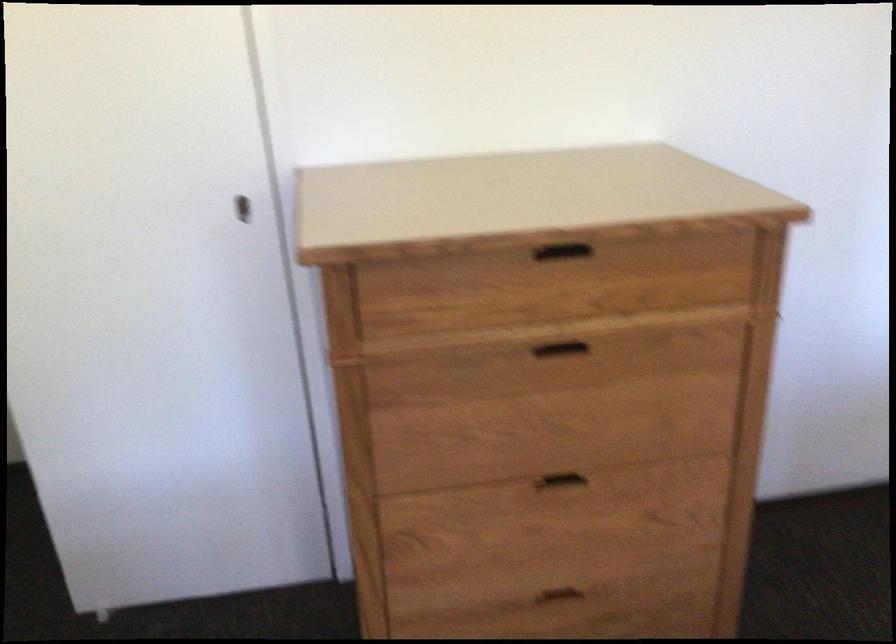
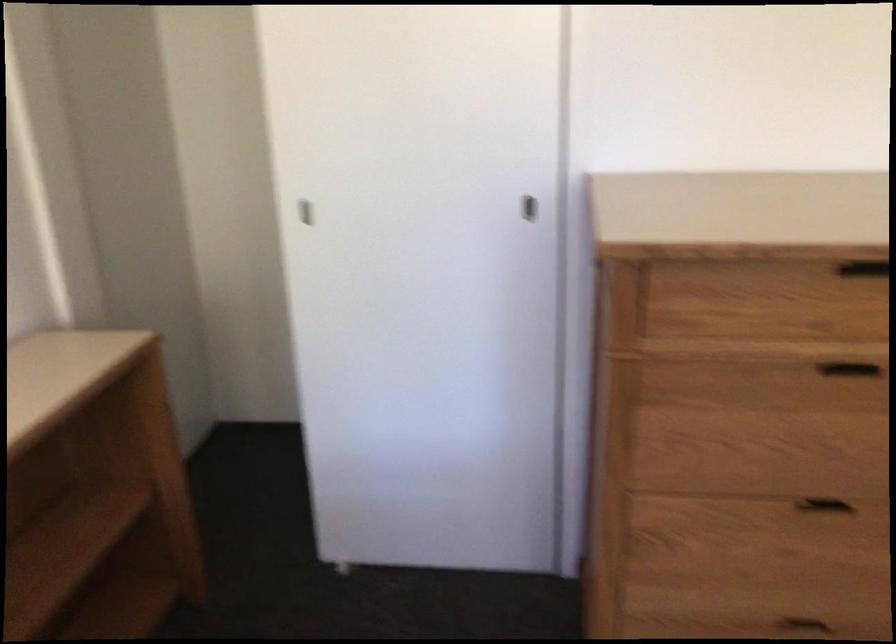
Where in the second image is the point corresponding to [247,214] from the first image?

(530, 209)